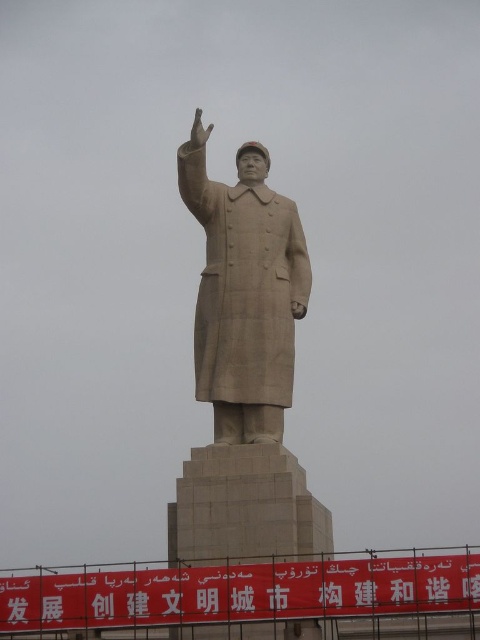
Question: Which object appears farthest from the camera in this image?

Choices:
 (A) matte stone statue at center
 (B) matte stone hand at upper center

Answer: (B)

Question: Which of the following is the farthest from the observer?

Choices:
 (A) (250, 278)
 (B) (191, 136)

Answer: (A)

Question: Is the position of matte stone statue at center less distant than that of matte stone hand at upper center?

Choices:
 (A) no
 (B) yes

Answer: (B)

Question: Does matte stone statue at center have a larger size compared to matte stone hand at upper center?

Choices:
 (A) no
 (B) yes

Answer: (B)

Question: Is matte stone statue at center further to camera compared to matte stone hand at upper center?

Choices:
 (A) no
 (B) yes

Answer: (A)